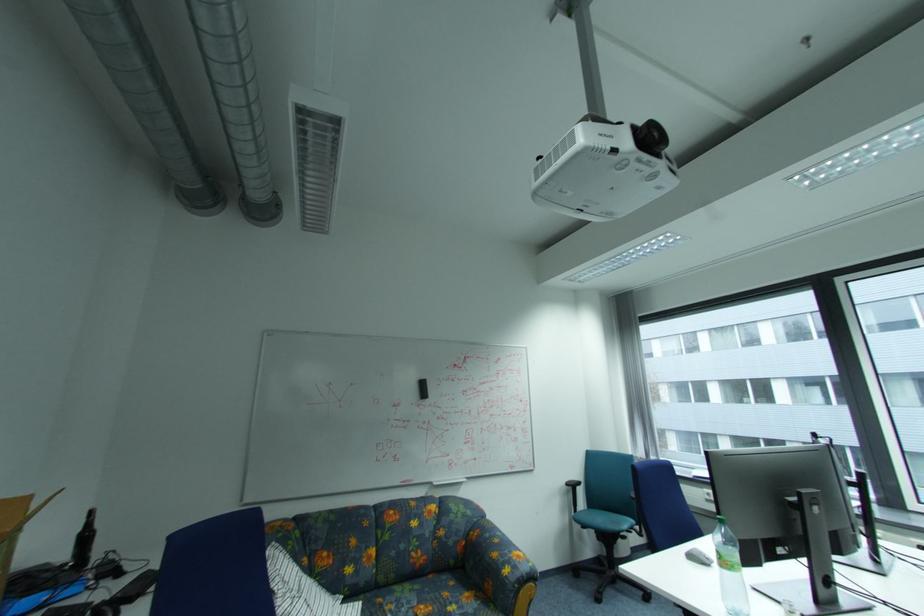
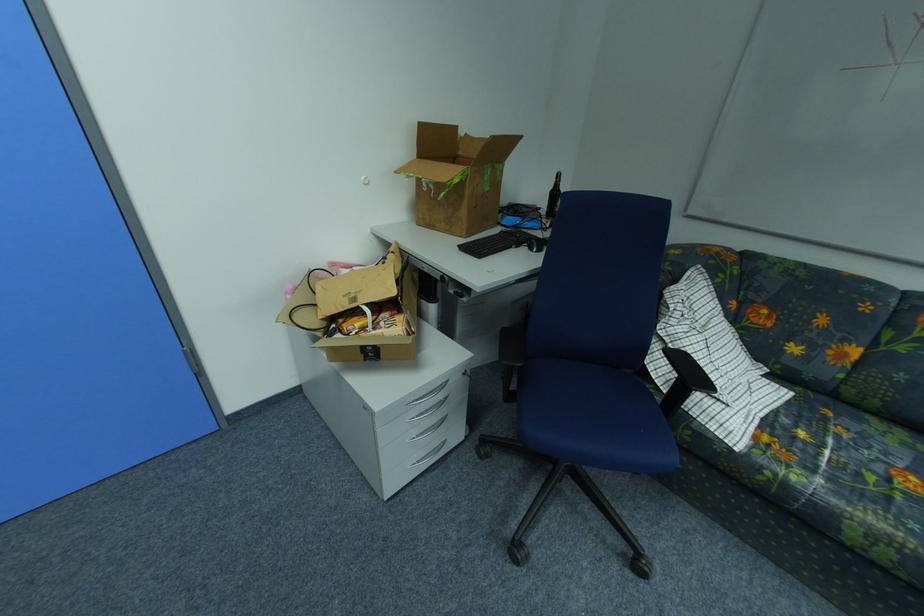
From the picture: First-person continuous shooting, in which direction is the camera rotating?

The rotation direction of the camera is left-down.